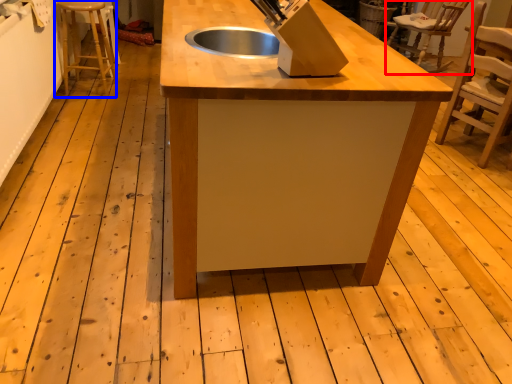
Question: Which of the following is the closest to the observer, chair (highlighted by a red box) or step stool (highlighted by a blue box)?

Choices:
 (A) chair
 (B) step stool

Answer: (B)